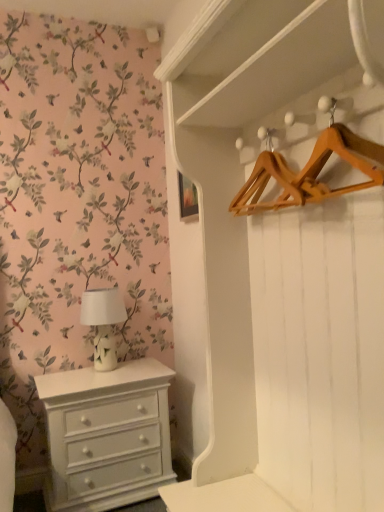
Question: Is wooden hanger at upper right turned away from white glossy table lamp at left?

Choices:
 (A) no
 (B) yes

Answer: (A)

Question: Is there a large distance between wooden hanger at upper right and white glossy table lamp at left?

Choices:
 (A) yes
 (B) no

Answer: (A)

Question: Does wooden hanger at upper right have a lesser width compared to white glossy table lamp at left?

Choices:
 (A) yes
 (B) no

Answer: (A)

Question: From a real-world perspective, is wooden hanger at upper right located higher than white glossy table lamp at left?

Choices:
 (A) no
 (B) yes

Answer: (B)

Question: Is wooden hanger at upper right not within white glossy table lamp at left?

Choices:
 (A) yes
 (B) no

Answer: (A)

Question: Does wooden hanger at upper right appear on the left side of white glossy table lamp at left?

Choices:
 (A) yes
 (B) no

Answer: (B)

Question: Does white painted wood chest of drawers at lower left have a smaller size compared to wooden hanger at upper right?

Choices:
 (A) yes
 (B) no

Answer: (B)

Question: Is white painted wood chest of drawers at lower left oriented towards wooden hanger at upper right?

Choices:
 (A) yes
 (B) no

Answer: (B)

Question: From a real-world perspective, is white painted wood chest of drawers at lower left physically below wooden hanger at upper right?

Choices:
 (A) no
 (B) yes

Answer: (B)

Question: Is white painted wood chest of drawers at lower left next to wooden hanger at upper right?

Choices:
 (A) no
 (B) yes

Answer: (A)

Question: Can you confirm if white painted wood chest of drawers at lower left is taller than wooden hanger at upper right?

Choices:
 (A) no
 (B) yes

Answer: (B)

Question: Is white painted wood chest of drawers at lower left positioned behind wooden hanger at upper right?

Choices:
 (A) no
 (B) yes

Answer: (B)

Question: From a real-world perspective, is white painted wood chest of drawers at lower left beneath white glossy table lamp at left?

Choices:
 (A) yes
 (B) no

Answer: (A)